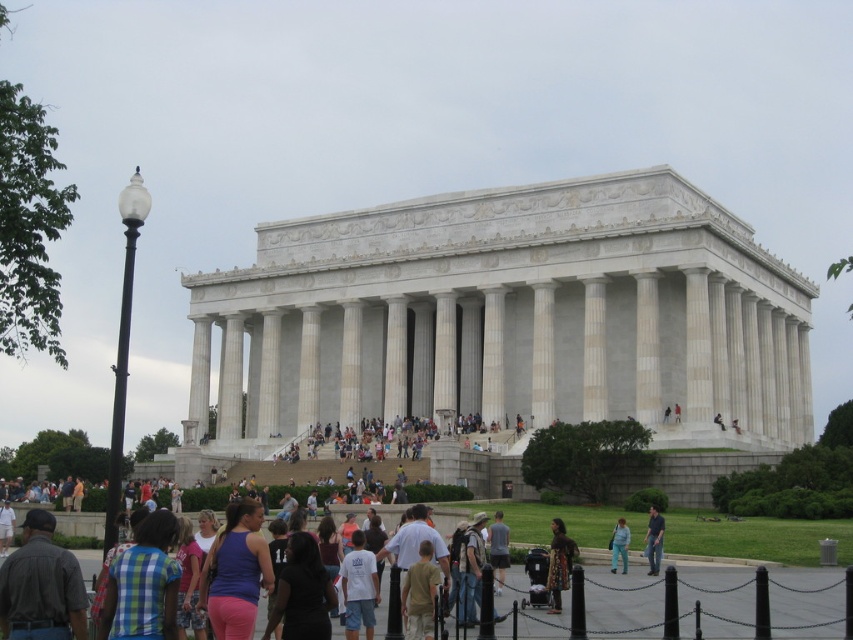
Question: Among these objects, which one is nearest to the camera?

Choices:
 (A) purple matte tank top at center
 (B) patterned fabric dress at center

Answer: (A)

Question: Does purple matte tank top at center have a lesser width compared to light blue shirt at center?

Choices:
 (A) yes
 (B) no

Answer: (B)

Question: Is dark gray shirt at lower left wider than denim pants at lower center?

Choices:
 (A) no
 (B) yes

Answer: (B)

Question: Which object appears closest to the camera in this image?

Choices:
 (A) patterned fabric dress at center
 (B) light blue shirt at center
 (C) purple matte tank top at center

Answer: (C)

Question: Is jeans at center bigger than denim pants at lower center?

Choices:
 (A) yes
 (B) no

Answer: (A)

Question: Which object is farther from the camera taking this photo?

Choices:
 (A) dark gray shirt at lower left
 (B) purple matte tank top at center
 (C) light blue shirt at center

Answer: (C)